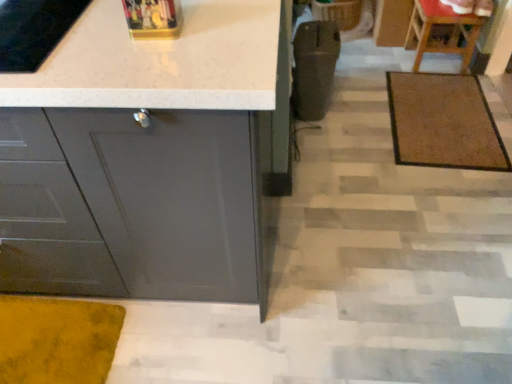
The image size is (512, 384). I want to click on vacant region to the left of wooden chair at upper right, so click(x=387, y=59).